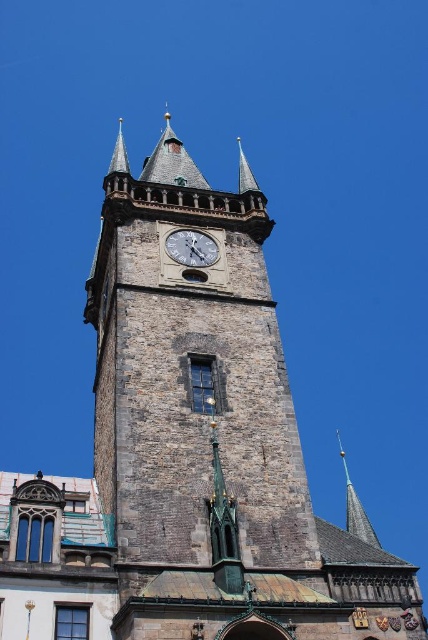
Question: Is silver metallic clock at center to the right of shiny gold spire at upper center from the viewer's perspective?

Choices:
 (A) yes
 (B) no

Answer: (B)

Question: Can you confirm if silver metallic clock at center is bigger than shiny gold spire at upper center?

Choices:
 (A) yes
 (B) no

Answer: (B)

Question: Is silver metallic clock at center positioned at the back of shiny gold spire at upper center?

Choices:
 (A) no
 (B) yes

Answer: (B)

Question: Which point is closer to the camera taking this photo?

Choices:
 (A) (365, 518)
 (B) (175, 252)

Answer: (A)